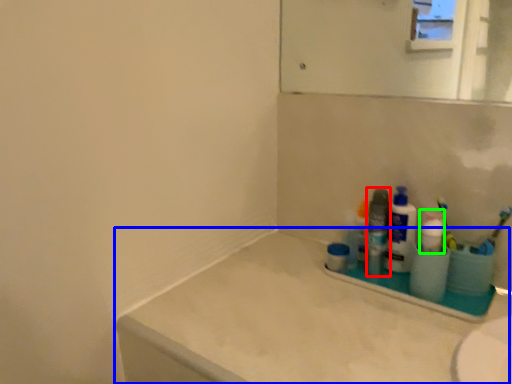
Question: Which object is positioned closest to toiletry (highlighted by a red box)? Select from counter top (highlighted by a blue box) and cleaning product (highlighted by a green box).

Choices:
 (A) counter top
 (B) cleaning product

Answer: (B)